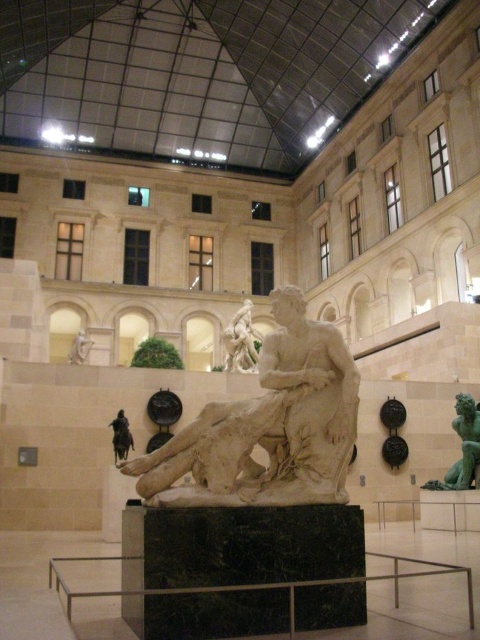
You are standing in the grand museum hall of the Louvre. You want to take a photo of the white marble statue at center. Where should you position yourself to capture the statue in the best possible view?

The white marble statue at center is located at point 2D coordinates of (267, 426). To capture the statue in the best possible view, position yourself directly in front of it, ensuring the statue is centered within your camera frame.

You are an art student visiting the museum and want to take a photo of both the green patina statue at right and the white marble bust at upper left. Which object should you focus on first if you want to capture their full height in a single frame without moving your camera?

The green patina statue at right is much taller than the white marble bust at upper left, so you should focus on capturing the green patina statue at right first to ensure its full height fits in the frame, then adjust slightly to include the smaller white marble bust at upper left.